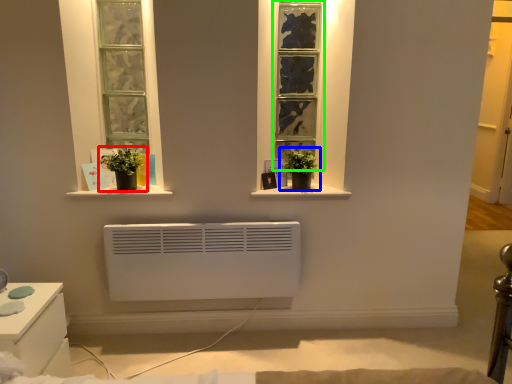
Question: Which is nearer to the houseplant (highlighted by a red box)? houseplant (highlighted by a blue box) or window (highlighted by a green box).

Choices:
 (A) houseplant
 (B) window

Answer: (A)